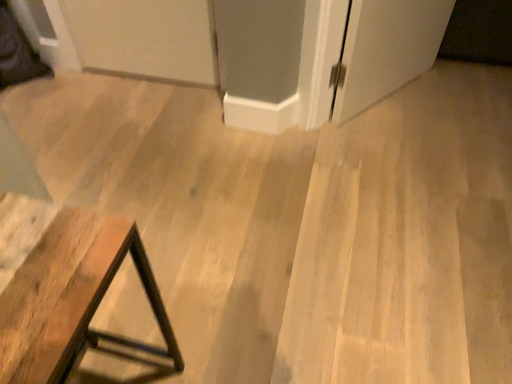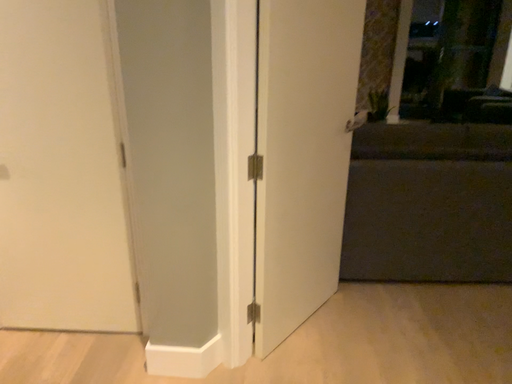
Question: Which way did the camera rotate in the video?

Choices:
 (A) rotated downward
 (B) rotated upward

Answer: (B)